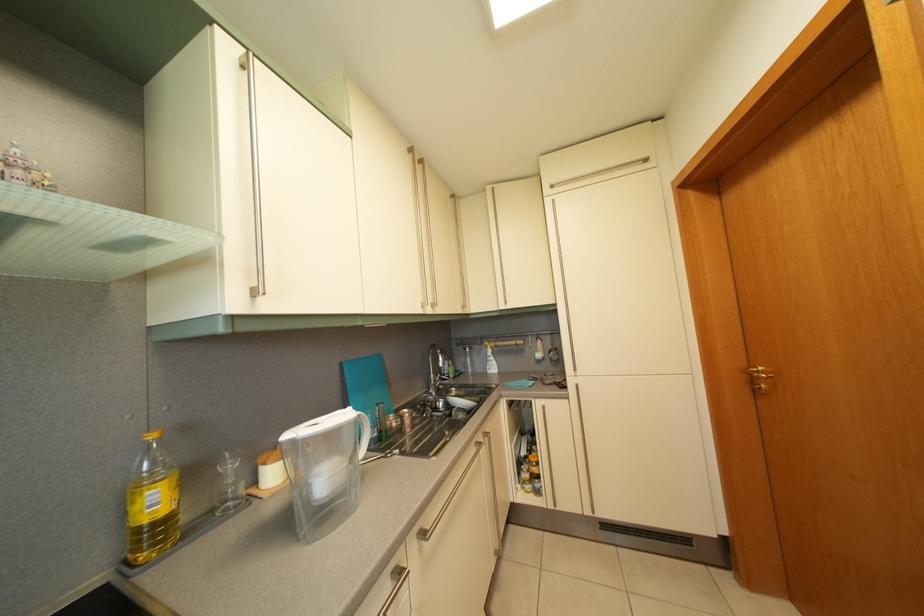
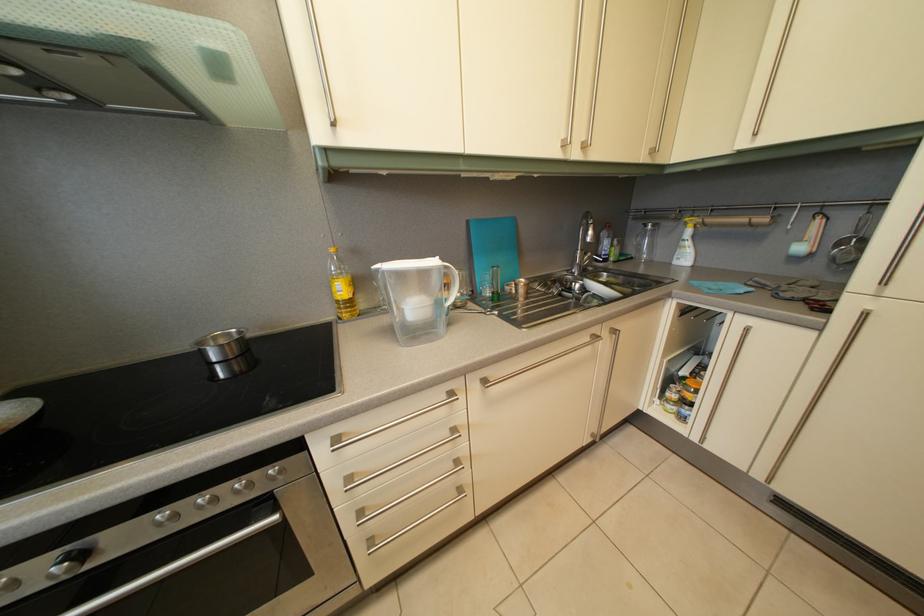
Find the pixel in the second image that matches [494,354] in the first image.

(694, 232)